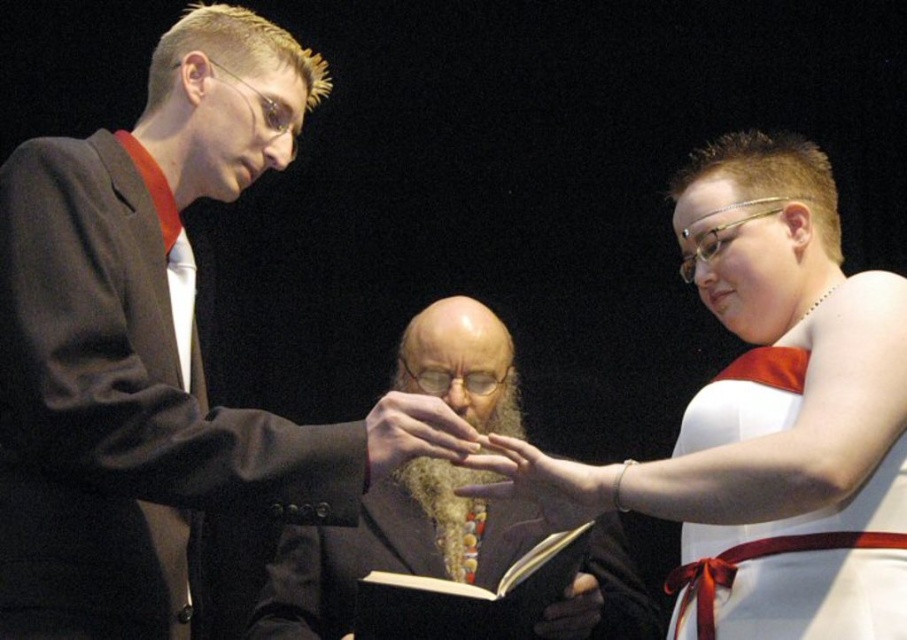
Question: Is white satin dress at center below black leather book at center?

Choices:
 (A) no
 (B) yes

Answer: (A)

Question: Is white satin dress at center to the right of bearded man at center from the viewer's perspective?

Choices:
 (A) yes
 (B) no

Answer: (A)

Question: Which object appears closest to the camera in this image?

Choices:
 (A) matte gold ring at center
 (B) white satin dress at right
 (C) bearded man at center
 (D) matte black suit at left

Answer: (D)

Question: Which of the following is the closest to the observer?

Choices:
 (A) golden curly beard at center
 (B) brown leather glove at center
 (C) black leather book at center

Answer: (C)

Question: Among these points, which one is farthest from the camera?

Choices:
 (A) (512, 472)
 (B) (581, 580)

Answer: (B)

Question: Can you confirm if white satin dress at right is positioned below smooth skin hand at center?

Choices:
 (A) no
 (B) yes

Answer: (B)